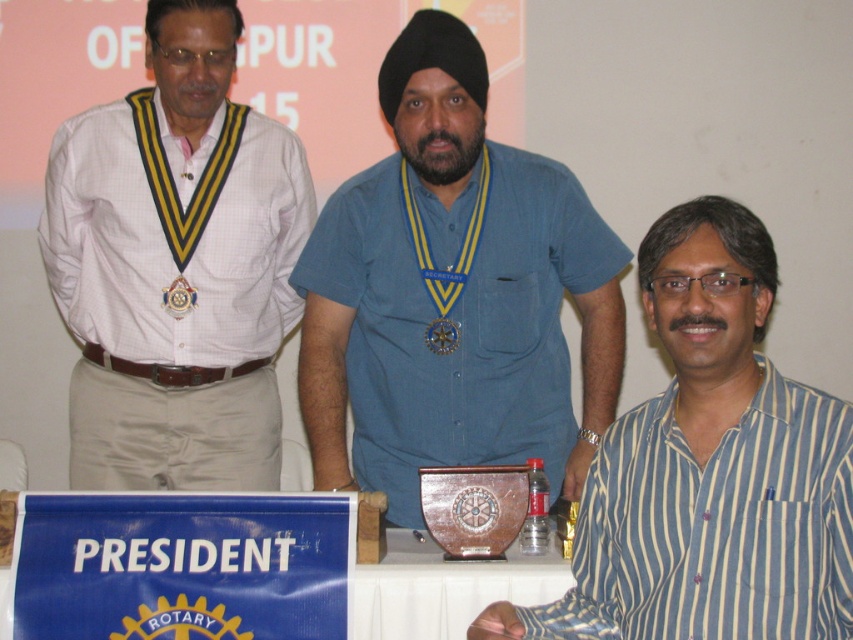
Who is higher up, white checkered shirt at left or gold metallic medallion at center?

white checkered shirt at left is above.

Does white checkered shirt at left have a greater width compared to gold metallic medallion at center?

Indeed, white checkered shirt at left has a greater width compared to gold metallic medallion at center.

Find the location of a particular element. white checkered shirt at left is located at coordinates (177, 266).

Can you confirm if blue denim shirt at center is positioned to the right of gold metallic medal at center?

Correct, you'll find blue denim shirt at center to the right of gold metallic medal at center.

At what (x,y) coordinates should I click in order to perform the action: click on blue denim shirt at center. Please return your answer as a coordinate pair (x, y). This screenshot has width=853, height=640. Looking at the image, I should click on (453, 292).

You are a GUI agent. You are given a task and a screenshot of the screen. Output one action in this format:
    pyautogui.click(x=<x>, y=<y>)
    Task: Click on the blue denim shirt at center
    Image resolution: width=853 pixels, height=640 pixels.
    Given the screenshot: What is the action you would take?
    [x=453, y=292]

Does blue denim shirt at center have a lesser width compared to gold metallic medallion at center?

No, blue denim shirt at center is not thinner than gold metallic medallion at center.

In the scene shown: Can you confirm if blue denim shirt at center is bigger than gold metallic medallion at center?

Indeed, blue denim shirt at center has a larger size compared to gold metallic medallion at center.

Is point (308, 340) closer to viewer compared to point (167, 298)?

Yes.

What are the coordinates of `blue denim shirt at center` in the screenshot? It's located at (453, 292).